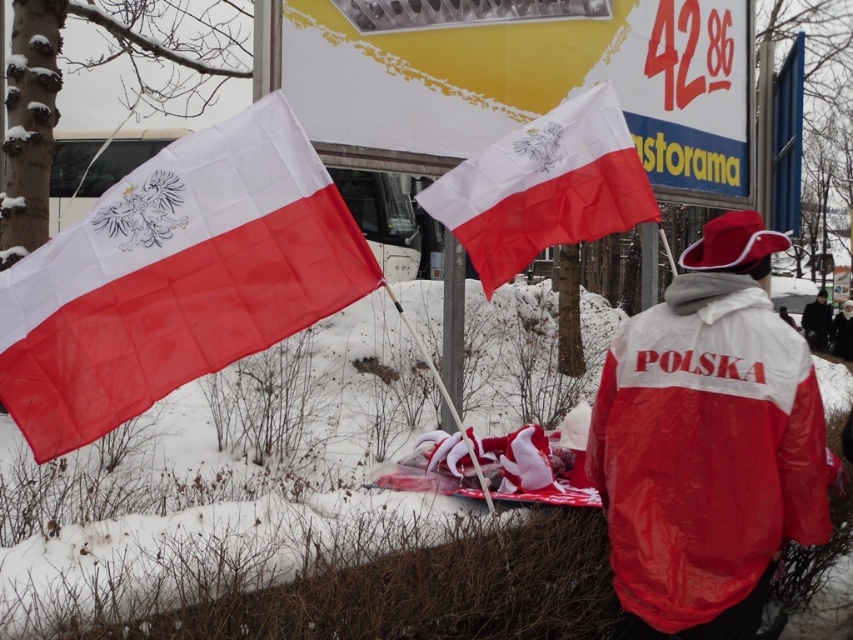
Question: Is white fabric flag at left to the left of crinkled fabric flag at center from the viewer's perspective?

Choices:
 (A) yes
 (B) no

Answer: (A)

Question: Is crinkled fabric flag at center to the left of black leather jacket at right from the viewer's perspective?

Choices:
 (A) yes
 (B) no

Answer: (A)

Question: Which of the following is the closest to the observer?

Choices:
 (A) crinkled fabric flag at center
 (B) black leather jacket at right
 (C) matte red jacket at center
 (D) white fabric flag at left

Answer: (D)

Question: Where is matte red jacket at center located in relation to black leather jacket at right in the image?

Choices:
 (A) right
 (B) left

Answer: (B)

Question: Which is nearer to the white fabric flag at left?

Choices:
 (A) black leather jacket at right
 (B) crinkled fabric flag at center

Answer: (B)

Question: Which point appears closest to the camera in this image?

Choices:
 (A) (601, 157)
 (B) (225, 125)

Answer: (B)